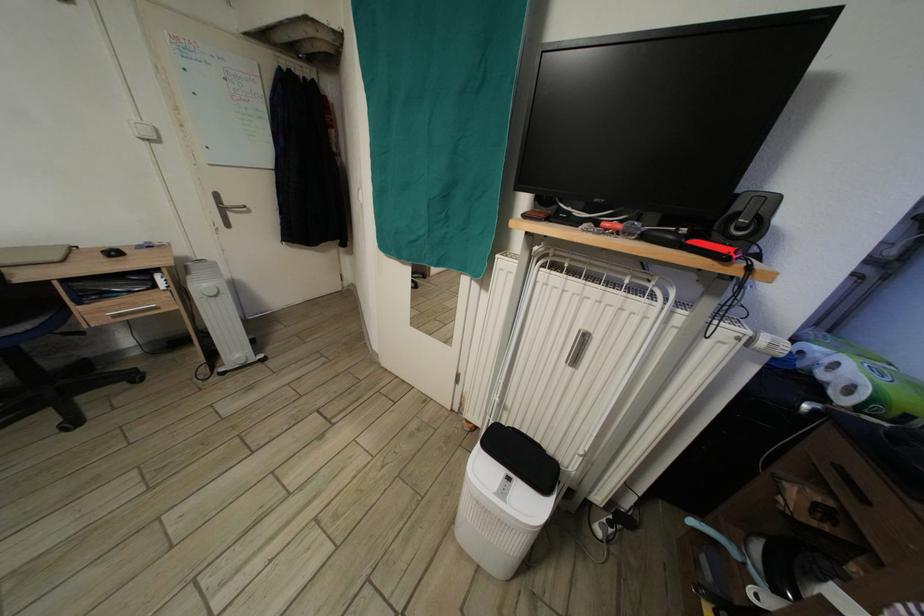
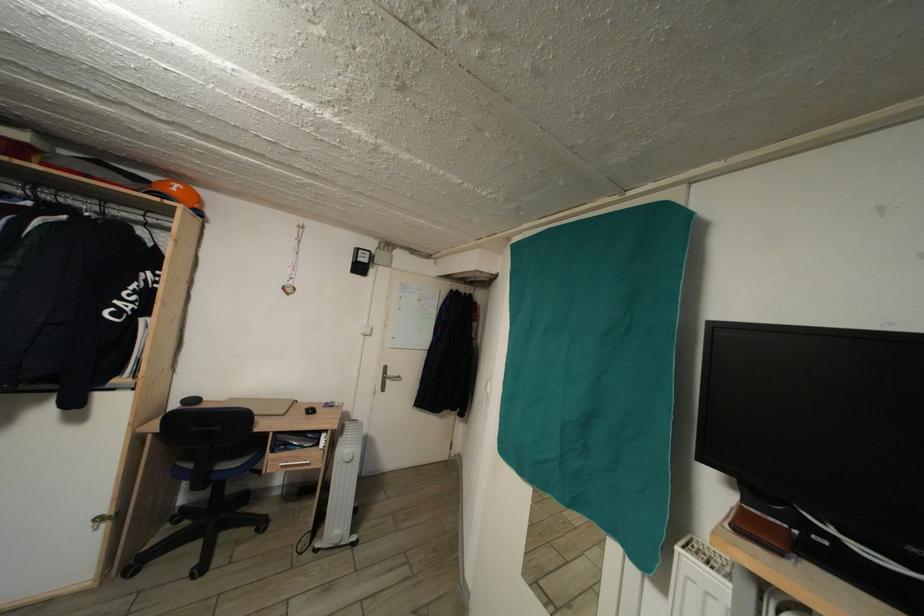
The images are taken continuously from a first-person perspective. In which direction is your viewpoint rotating?

The rotation direction of the camera is left-up.